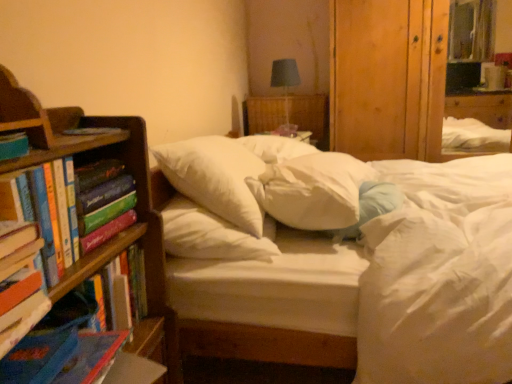
Question: Is matte blue book at left, positioned as the 2th book in front-to-back order, shorter than white soft pillow at center, which is the third pillow from right to left?

Choices:
 (A) no
 (B) yes

Answer: (B)

Question: Considering the relative sizes of matte blue book at left, which ranks as the third book in back-to-front order, and white soft pillow at center, the first pillow in the left-to-right sequence, in the image provided, is matte blue book at left, which ranks as the third book in back-to-front order, bigger than white soft pillow at center, the first pillow in the left-to-right sequence,?

Choices:
 (A) no
 (B) yes

Answer: (A)

Question: Is matte blue book at left, which ranks as the third book in back-to-front order, at the right side of white soft pillow at center, the first pillow in the left-to-right sequence?

Choices:
 (A) no
 (B) yes

Answer: (A)

Question: From a real-world perspective, does matte blue book at left, which ranks as the third book in back-to-front order, stand above white soft pillow at center, which is the third pillow from right to left?

Choices:
 (A) yes
 (B) no

Answer: (A)

Question: Does matte blue book at left, which ranks as the third book in back-to-front order, have a greater width compared to white soft pillow at center, the first pillow in the left-to-right sequence?

Choices:
 (A) yes
 (B) no

Answer: (B)

Question: In the image, is hardcover book at left, placed as the 4th book when sorted from back to front, on the left side or the right side of wooden bookshelf at left?

Choices:
 (A) left
 (B) right

Answer: (A)

Question: From the image's perspective, is hardcover book at left, placed as the 4th book when sorted from back to front, positioned above or below wooden bookshelf at left?

Choices:
 (A) below
 (B) above

Answer: (B)

Question: Considering the positions of point coord(17,271) and point coord(71,273), is point coord(17,271) closer or farther from the camera than point coord(71,273)?

Choices:
 (A) farther
 (B) closer

Answer: (B)

Question: Considering their positions, is hardcover book at left, positioned as the first book in front-to-back order, located in front of or behind wooden bookshelf at left?

Choices:
 (A) behind
 (B) front

Answer: (B)

Question: Does point (138, 301) appear closer or farther from the camera than point (250, 100)?

Choices:
 (A) closer
 (B) farther

Answer: (A)

Question: Is hardcover book at left, marked as the 4th book in a front-to-back arrangement, in front of or behind wooden table at center in the image?

Choices:
 (A) front
 (B) behind

Answer: (A)

Question: In terms of width, does hardcover book at left, marked as the 1th book in a back-to-front arrangement, look wider or thinner when compared to wooden table at center?

Choices:
 (A) wide
 (B) thin

Answer: (B)

Question: Would you say hardcover book at left, marked as the 1th book in a back-to-front arrangement, is to the left or to the right of wooden table at center in the picture?

Choices:
 (A) left
 (B) right

Answer: (A)

Question: Based on their sizes in the image, would you say white soft pillow at center, the first pillow in the left-to-right sequence, is bigger or smaller than wooden bookshelf at left?

Choices:
 (A) small
 (B) big

Answer: (A)

Question: From a real-world perspective, is white soft pillow at center, the first pillow in the left-to-right sequence, positioned above or below wooden bookshelf at left?

Choices:
 (A) below
 (B) above

Answer: (B)